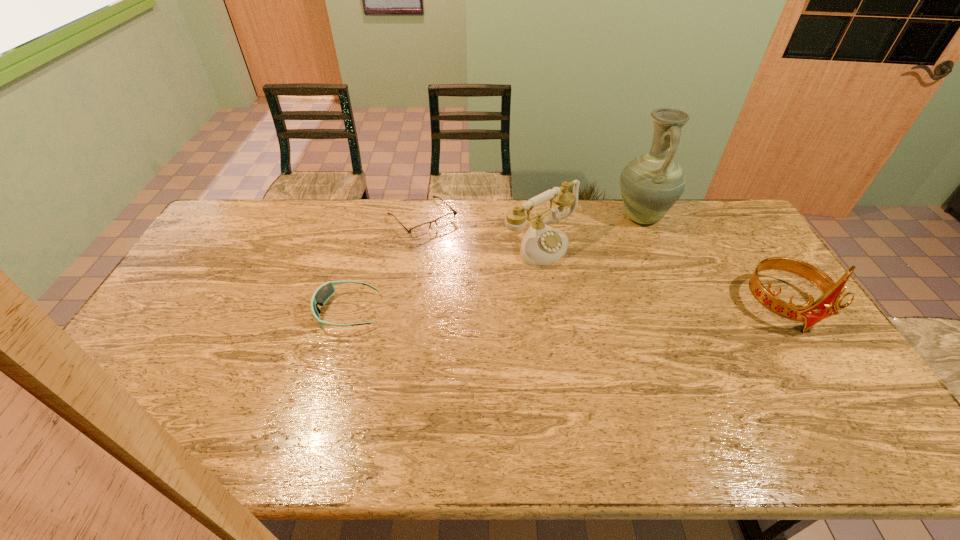
At what (x,y) coordinates should I click in order to perform the action: click on free space on the desktop that is between the goggles and the fourth shortest object and is positioned on the dial of the third object from left to right. Please return your answer as a coordinate pair (x, y). The height and width of the screenshot is (540, 960). Looking at the image, I should click on (629, 308).

At what (x,y) coordinates should I click in order to perform the action: click on vacant space on the desktop that is between the second shortest object and the tiara and is positioned on the front-facing side of the shortest object. Please return your answer as a coordinate pair (x, y). The image size is (960, 540). Looking at the image, I should click on (508, 309).

Find the location of a particular element. The image size is (960, 540). free space on the desktop that is between the goggles and the rightmost object and is positioned on the handle side of the tallest object is located at coordinates (607, 308).